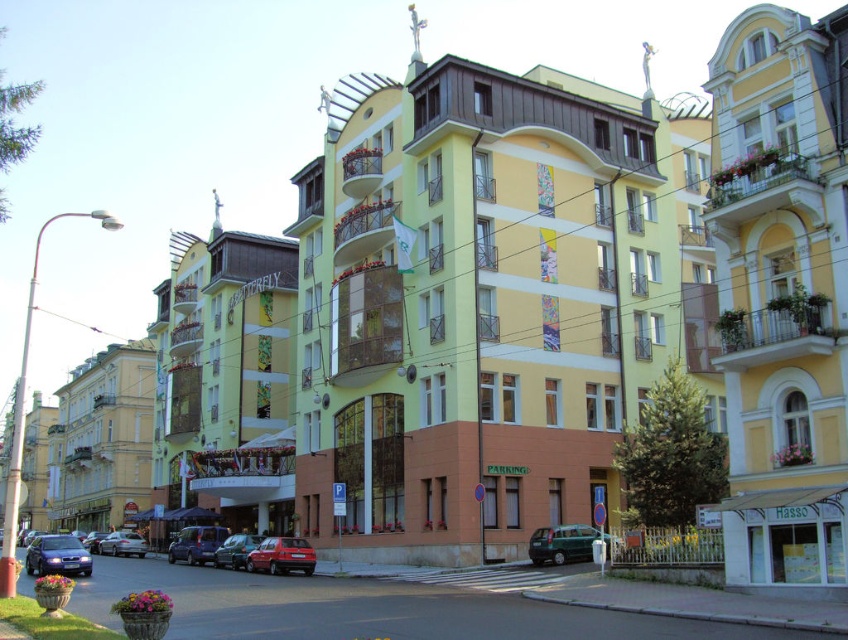
You are a pedestrian standing at the pedestrian crossing in front of the building. You see a metallic green van at center and a metallic silver car at center. Which vehicle is positioned more to the right side of the street?

The metallic green van at center is positioned more to the right side of the street compared to the metallic silver car at center.

In the scene shown: You are a photographer trying to capture both the beige stone building at left and the matte red car at lower center in a single frame. Given their sizes, which object should you position closer to the camera to ensure both are visible in the shot?

The beige stone building at left is bigger than the matte red car at lower center, so you should position the matte red car at lower center closer to the camera to balance their sizes in the frame.